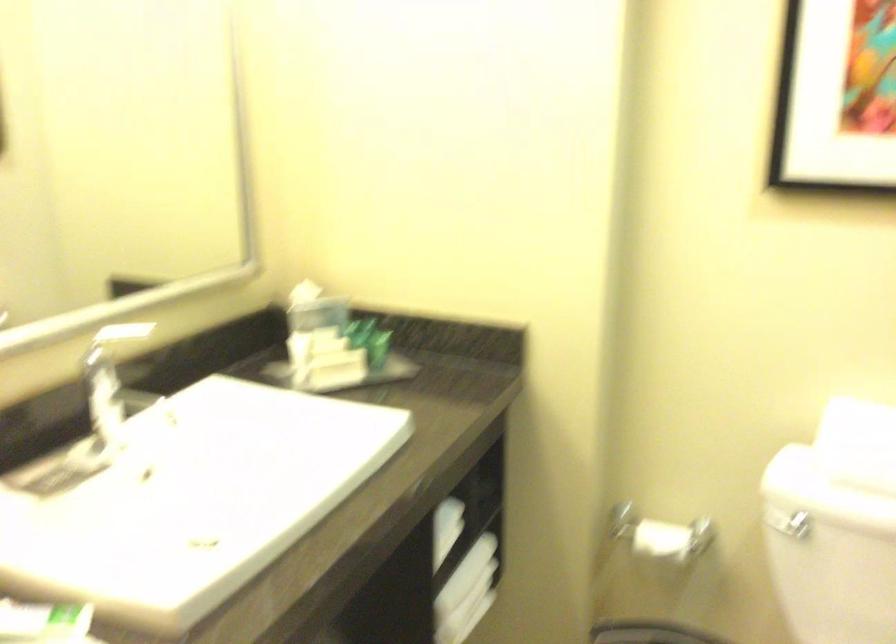
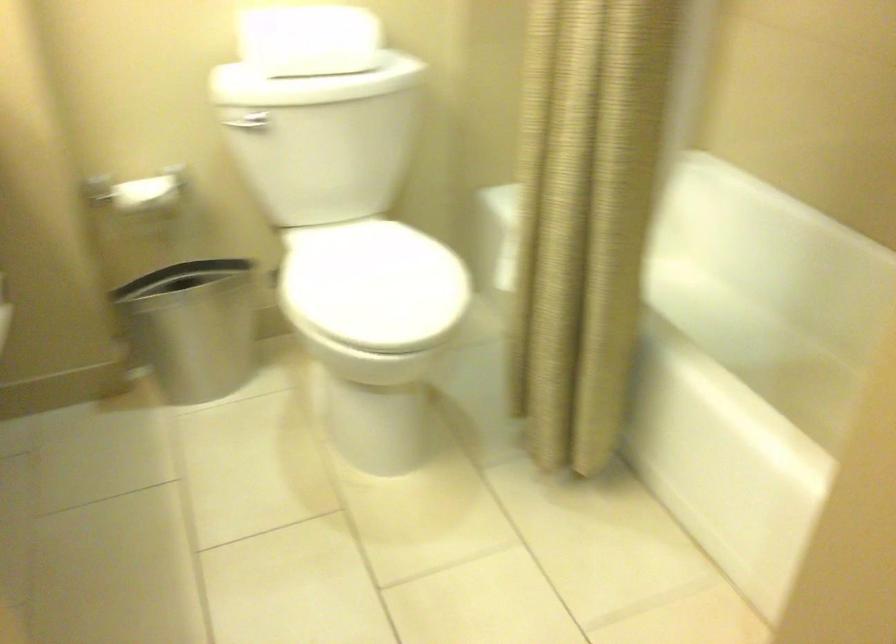
The point at (662, 544) is marked in the first image. Where is the corresponding point in the second image?

(147, 193)